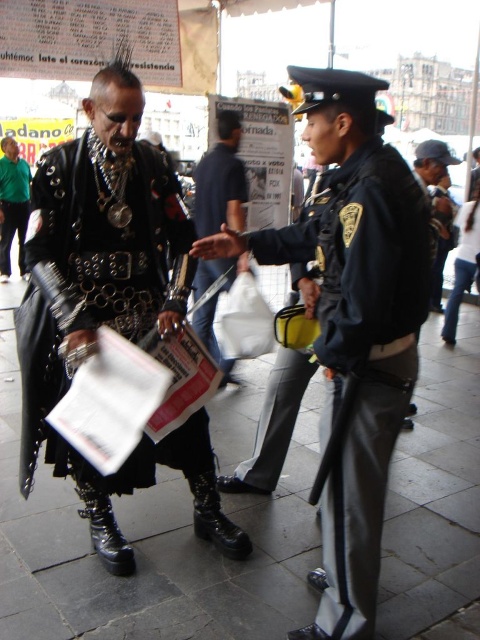
Is dark blue uniform at center taller than leather jacket at center?

Yes.

Does point (340, 72) come behind point (78, 163)?

No, it is not.

Where is `dark blue uniform at center`? dark blue uniform at center is located at coordinates (354, 328).

This screenshot has width=480, height=640. Identify the location of dark blue uniform at center. (354, 328).

Which is behind, point (352, 364) or point (240, 225)?

The point (240, 225) is more distant.

Between dark blue uniform at center and dark blue jeans at center, which one has less height?

dark blue jeans at center

Does point (309, 236) come closer to viewer compared to point (201, 170)?

Yes, it is in front of point (201, 170).

The image size is (480, 640). Find the location of `dark blue uniform at center`. dark blue uniform at center is located at coordinates (354, 328).

Between point (116, 321) and point (25, 202), which one is positioned in front?

Point (116, 321) is more forward.

Is leather jacket at center to the right of matte black leather jacket at left from the viewer's perspective?

Correct, you'll find leather jacket at center to the right of matte black leather jacket at left.

Identify the location of leather jacket at center. This screenshot has width=480, height=640. (101, 292).